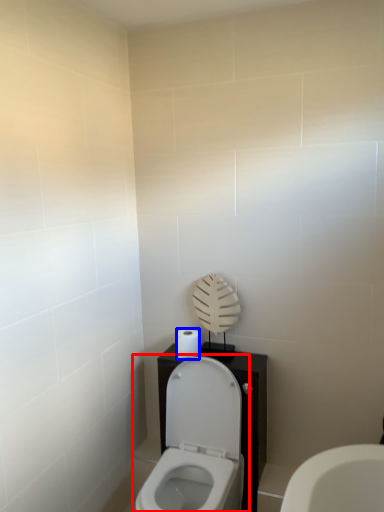
Question: Which object appears farthest to the camera in this image, toilet (highlighted by a red box) or toilet paper (highlighted by a blue box)?

Choices:
 (A) toilet
 (B) toilet paper

Answer: (B)